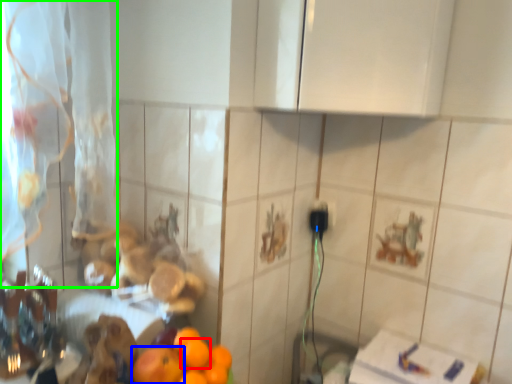
Question: Which object is positioned farthest from orange (highlighted by a red box)? Select from orange (highlighted by a blue box) and curtain (highlighted by a green box).

Choices:
 (A) orange
 (B) curtain

Answer: (B)